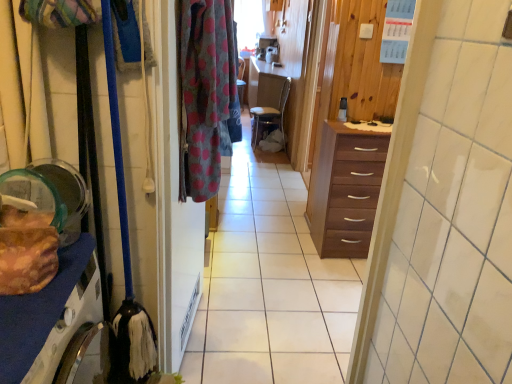
Question: Does white glossy counter top at center come in front of polka dot fabric at center?

Choices:
 (A) no
 (B) yes

Answer: (A)

Question: Is white glossy counter top at center bigger than polka dot fabric at center?

Choices:
 (A) yes
 (B) no

Answer: (B)

Question: Can you confirm if white glossy counter top at center is taller than polka dot fabric at center?

Choices:
 (A) yes
 (B) no

Answer: (B)

Question: Is white glossy counter top at center thinner than polka dot fabric at center?

Choices:
 (A) yes
 (B) no

Answer: (B)

Question: Does white glossy counter top at center have a smaller size compared to polka dot fabric at center?

Choices:
 (A) no
 (B) yes

Answer: (B)

Question: Can you confirm if white glossy counter top at center is positioned to the left of polka dot fabric at center?

Choices:
 (A) no
 (B) yes

Answer: (A)

Question: From a real-world perspective, is polka dot fabric screen door at center below white glossy counter top at center?

Choices:
 (A) no
 (B) yes

Answer: (B)

Question: Is polka dot fabric screen door at center positioned before white glossy counter top at center?

Choices:
 (A) yes
 (B) no

Answer: (A)

Question: From a real-world perspective, is polka dot fabric screen door at center over white glossy counter top at center?

Choices:
 (A) no
 (B) yes

Answer: (A)

Question: Considering the relative positions of polka dot fabric screen door at center and white glossy counter top at center in the image provided, is polka dot fabric screen door at center to the right of white glossy counter top at center from the viewer's perspective?

Choices:
 (A) yes
 (B) no

Answer: (B)

Question: Is polka dot fabric screen door at center smaller than white glossy counter top at center?

Choices:
 (A) yes
 (B) no

Answer: (B)

Question: From the image's perspective, is polka dot fabric screen door at center located beneath white glossy counter top at center?

Choices:
 (A) no
 (B) yes

Answer: (B)

Question: Is polka dot fabric screen door at center at the right side of matte black coffee cup at center?

Choices:
 (A) no
 (B) yes

Answer: (A)